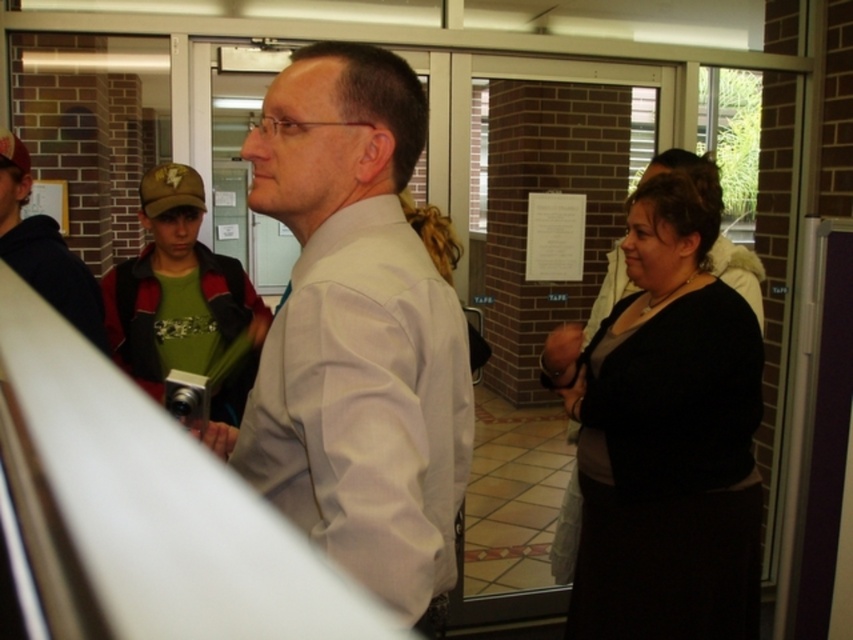
Is point (334, 339) more distant than point (165, 365)?

No, it is in front of (165, 365).

Is point (289, 180) less distant than point (115, 301)?

Yes, point (289, 180) is closer to viewer.

Between point (302, 390) and point (135, 364), which one is positioned behind?

The point (135, 364) is more distant.

Identify the location of white smooth shirt at center. (357, 332).

Describe the element at coordinates (666, 435) in the screenshot. This screenshot has height=640, width=853. I see `black matte dress at right` at that location.

Can you confirm if black matte dress at right is smaller than matte white shirt at center?

Incorrect, black matte dress at right is not smaller in size than matte white shirt at center.

What do you see at coordinates (666, 435) in the screenshot? The height and width of the screenshot is (640, 853). I see `black matte dress at right` at bounding box center [666, 435].

This screenshot has height=640, width=853. I want to click on black matte dress at right, so click(666, 435).

Identify the location of black matte dress at right. Image resolution: width=853 pixels, height=640 pixels. (666, 435).

Is point (718, 589) less distant than point (108, 352)?

Yes, point (718, 589) is in front of point (108, 352).

Locate an element on the screen. The height and width of the screenshot is (640, 853). black matte dress at right is located at coordinates (666, 435).

What are the coordinates of `black matte dress at right` in the screenshot? It's located at (666, 435).